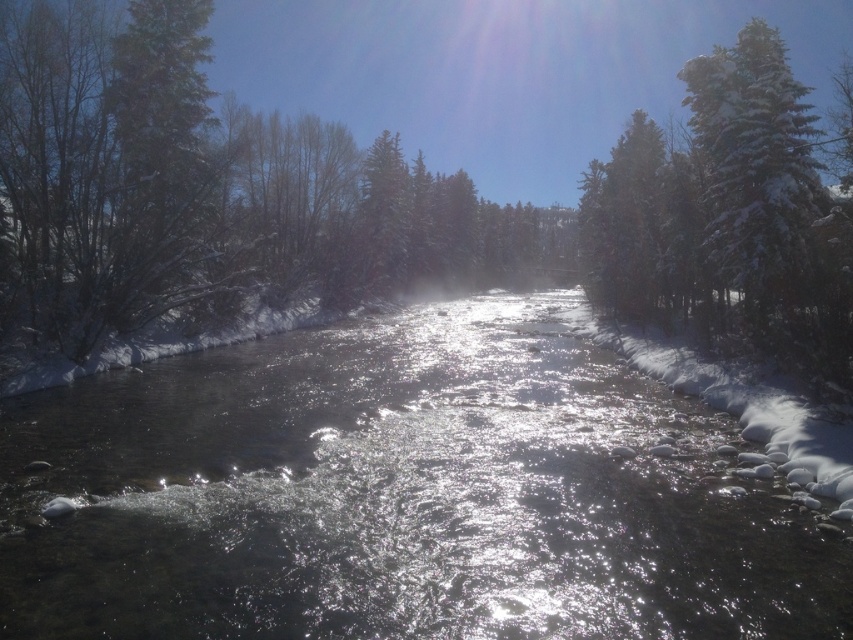
Is clear water at center positioned at the back of snow-covered evergreen at upper right?

No, clear water at center is in front of snow-covered evergreen at upper right.

Is point (733, 483) behind point (743, 280)?

No, (733, 483) is in front of (743, 280).

Which is behind, point (618, 380) or point (785, 99)?

Point (618, 380)

Locate an element on the screen. Image resolution: width=853 pixels, height=640 pixels. clear water at center is located at coordinates 398,497.